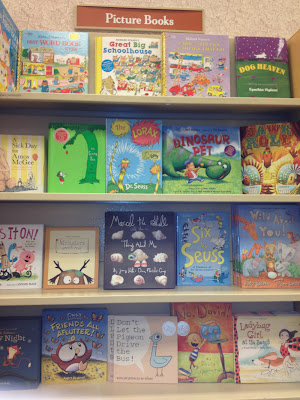
The height and width of the screenshot is (400, 300). I want to click on shelves, so click(162, 300), click(146, 393), click(151, 198), click(162, 102).